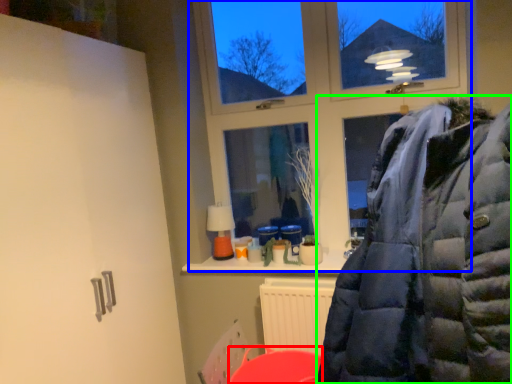
Question: Which object is the farthest from table (highlighted by a red box)? Choose among these: window (highlighted by a blue box) or jacket (highlighted by a green box).

Choices:
 (A) window
 (B) jacket

Answer: (B)